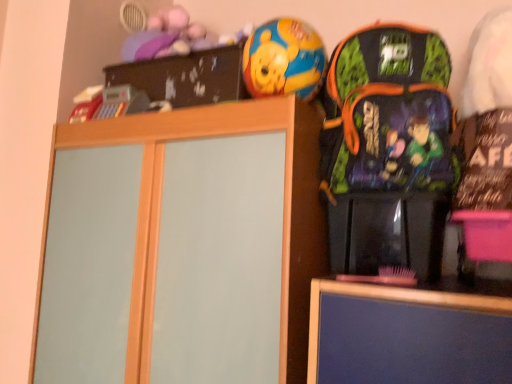
Question: Does multicolored fabric backpack at right lie behind wooden cabinet at center?

Choices:
 (A) yes
 (B) no

Answer: (B)

Question: Considering the relative positions of multicolored fabric backpack at right and wooden cabinet at center in the image provided, is multicolored fabric backpack at right to the left of wooden cabinet at center from the viewer's perspective?

Choices:
 (A) no
 (B) yes

Answer: (A)

Question: Can you confirm if multicolored fabric backpack at right is thinner than wooden cabinet at center?

Choices:
 (A) no
 (B) yes

Answer: (B)

Question: Is multicolored fabric backpack at right positioned with its back to wooden cabinet at center?

Choices:
 (A) no
 (B) yes

Answer: (A)

Question: From the image's perspective, is multicolored fabric backpack at right below wooden cabinet at center?

Choices:
 (A) no
 (B) yes

Answer: (A)

Question: From the image's perspective, is shiny plastic ball at upper center located above or below wooden cabinet at center?

Choices:
 (A) below
 (B) above

Answer: (B)

Question: Which is correct: shiny plastic ball at upper center is inside wooden cabinet at center, or outside of it?

Choices:
 (A) inside
 (B) outside

Answer: (B)

Question: Is shiny plastic ball at upper center wider or thinner than wooden cabinet at center?

Choices:
 (A) wide
 (B) thin

Answer: (B)

Question: From a real-world perspective, is shiny plastic ball at upper center physically located above or below wooden cabinet at center?

Choices:
 (A) above
 (B) below

Answer: (A)

Question: Considering the positions of wooden cabinet at center and multicolored fabric backpack at right in the image, is wooden cabinet at center wider or thinner than multicolored fabric backpack at right?

Choices:
 (A) wide
 (B) thin

Answer: (A)

Question: Visually, is wooden cabinet at center positioned to the left or to the right of multicolored fabric backpack at right?

Choices:
 (A) left
 (B) right

Answer: (A)

Question: Is wooden cabinet at center situated inside multicolored fabric backpack at right or outside?

Choices:
 (A) inside
 (B) outside

Answer: (B)

Question: Relative to multicolored fabric backpack at right, is wooden cabinet at center in front or behind?

Choices:
 (A) front
 (B) behind

Answer: (B)

Question: Is multicolored fabric backpack at right in front of or behind shiny plastic ball at upper center in the image?

Choices:
 (A) front
 (B) behind

Answer: (A)

Question: From a real-world perspective, is multicolored fabric backpack at right positioned above or below shiny plastic ball at upper center?

Choices:
 (A) below
 (B) above

Answer: (A)